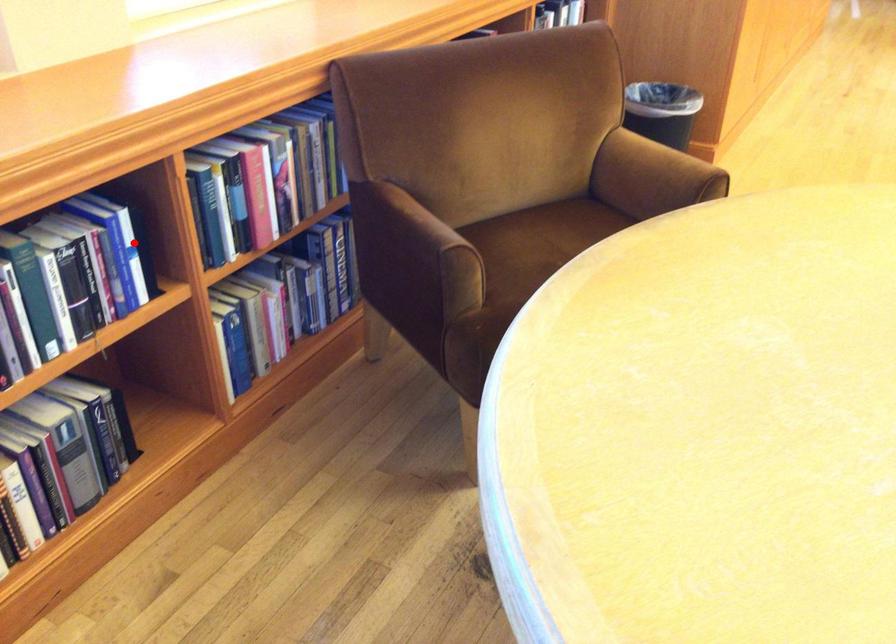
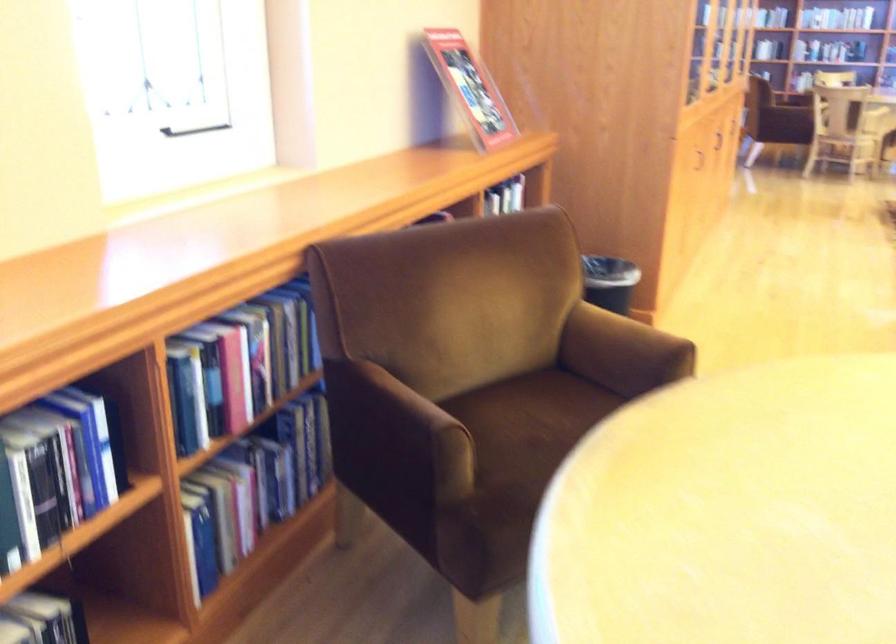
The point at the highlighted location is marked in the first image. Where is the corresponding point in the second image?

(108, 438)